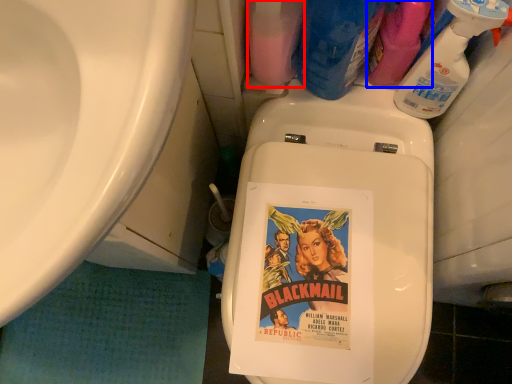
Question: Among these objects, which one is farthest to the camera, cleaning product (highlighted by a red box) or cleaning product (highlighted by a blue box)?

Choices:
 (A) cleaning product
 (B) cleaning product

Answer: (B)